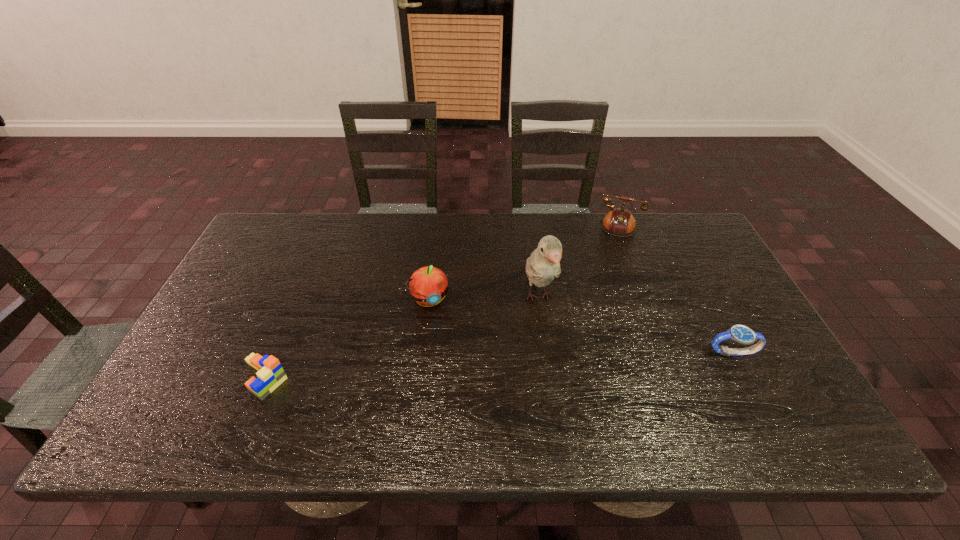
What are the coordinates of `free space between the farthest object and the third object from right to left` in the screenshot? It's located at (568, 262).

You are a GUI agent. You are given a task and a screenshot of the screen. Output one action in this format:
    pyautogui.click(x=<x>, y=<y>)
    Task: Click on the free space between the telephone and the rightmost object
    Image resolution: width=960 pixels, height=540 pixels.
    Given the screenshot: What is the action you would take?
    pyautogui.click(x=664, y=289)

In order to click on free point between the second object from right to left and the tallest object in this screenshot , I will do `click(568, 262)`.

Where is `vacant space that is in between the bird and the rightmost object`? vacant space that is in between the bird and the rightmost object is located at coordinates (636, 325).

Identify the location of blank region between the third object from left to right and the Lego. (401, 338).

The width and height of the screenshot is (960, 540). Identify the location of free space between the watch and the second object from left to right. (581, 326).

At what (x,y) coordinates should I click in order to perform the action: click on empty space that is in between the watch and the third object from left to right. Please return your answer as a coordinate pair (x, y). The width and height of the screenshot is (960, 540). Looking at the image, I should click on (636, 325).

Identify the location of free space between the apple and the bird. (485, 298).

I want to click on blank region between the rightmost object and the telephone, so click(664, 289).

Choose which object is the nearest neighbor to the Lego. Please provide its 2D coordinates. Your answer should be formatted as a tuple, i.e. [(x, y)], where the tuple contains the x and y coordinates of a point satisfying the conditions above.

[(428, 285)]